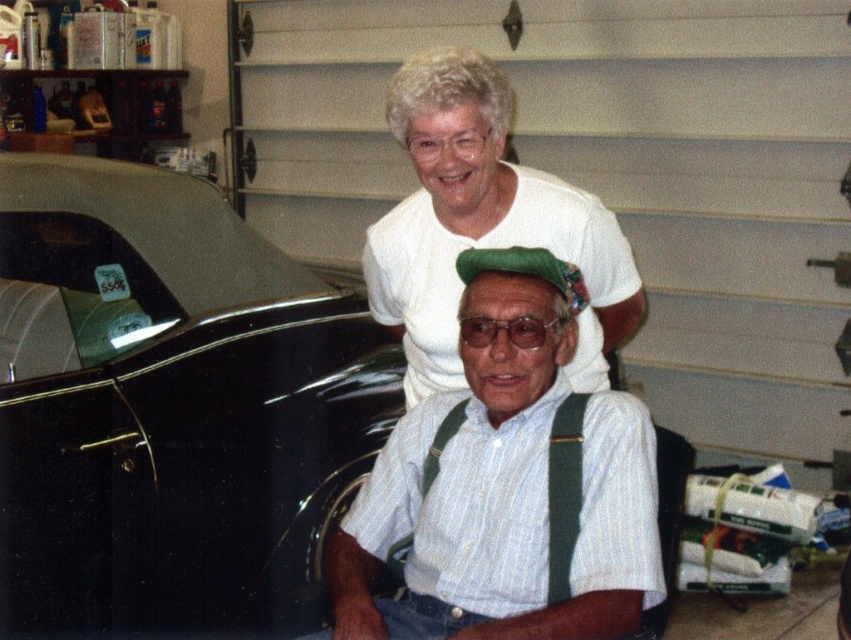
What do you see at coordinates (483, 224) in the screenshot? This screenshot has width=851, height=640. I see `white matte t-shirt at upper center` at bounding box center [483, 224].

Between point (504, 230) and point (568, 499), which one is positioned in front?

Point (568, 499)

Between point (545, 224) and point (564, 556), which one is positioned behind?

Positioned behind is point (545, 224).

Find the location of a particular element. Image resolution: width=851 pixels, height=640 pixels. white matte t-shirt at upper center is located at coordinates (483, 224).

Is point (523, 312) positioned in front of point (403, 312)?

Yes.

Is point (512, 584) positioned behind point (449, 156)?

No, (512, 584) is closer to viewer.

The image size is (851, 640). What are the coordinates of `white striped shirt at center` in the screenshot? It's located at (505, 484).

How distant is black glossy car at left from white striped shirt at center?

black glossy car at left is 1.05 meters from white striped shirt at center.

Is black glossy car at left bigger than white striped shirt at center?

Yes, black glossy car at left is bigger than white striped shirt at center.

You are a GUI agent. You are given a task and a screenshot of the screen. Output one action in this format:
    pyautogui.click(x=<x>, y=<y>)
    Task: Click on the black glossy car at left
    The width and height of the screenshot is (851, 640).
    Given the screenshot: What is the action you would take?
    pyautogui.click(x=175, y=412)